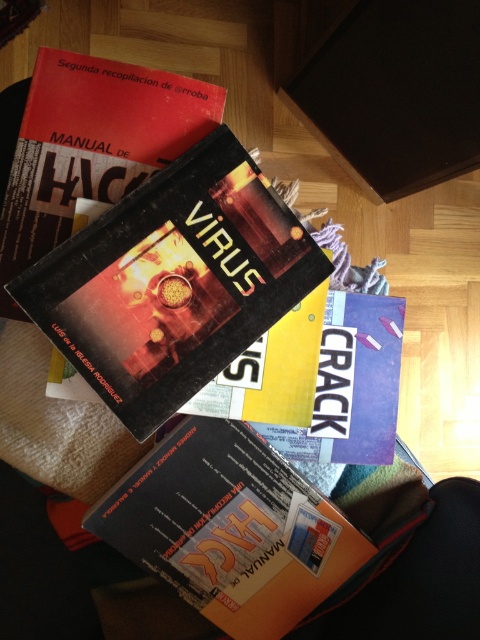
You are organizing a bookshelf and need to place the shiny metallic book at center and the matte black book at upper left. According to the current arrangement, which book should be placed to the right of the other?

The shiny metallic book at center should be placed to the right of the matte black book at upper left because it is positioned on the right side of it in the current arrangement.

You are organizing a bookshelf and have a space that can accommodate the width of the metallic blue book at center. Can the matte black book at upper left fit in this space?

The matte black book at upper left is wider than the metallic blue book at center, so it cannot fit in the space designated for the metallic blue book at center.

You are standing at the point marked by the coordinates point (252,547) and want to pick up an object from the scene. Can you reach the book with the black cover with a striking image of...? Please explain your reasoning based on the distance provided.

The distance between the point (252,547) and the viewer is 25.48 inches. Since the average human arm length is about 25 to 28 inches, it is possible to reach the object if the viewer extends their arm fully.